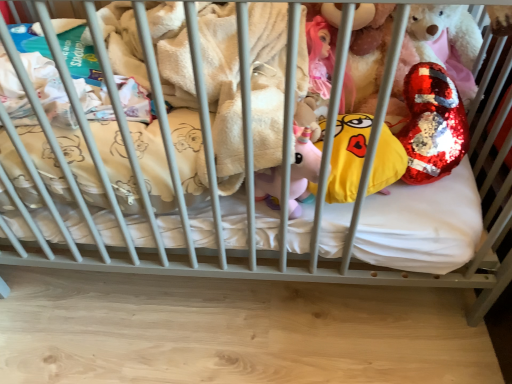
Question: From a real-world perspective, is white soft mattress at center physically located above or below yellow sequined pillow at center?

Choices:
 (A) above
 (B) below

Answer: (B)

Question: In the image, is white soft mattress at center on the left side or the right side of yellow sequined pillow at center?

Choices:
 (A) left
 (B) right

Answer: (A)

Question: Considering the real-world distances, which object is closest to the white soft mattress at center?

Choices:
 (A) yellow sequined pillow at center
 (B) shiny sequined heart at upper right

Answer: (A)

Question: Based on their relative distances, which object is nearer to the yellow sequined pillow at center?

Choices:
 (A) white soft mattress at center
 (B) shiny sequined heart at upper right

Answer: (B)